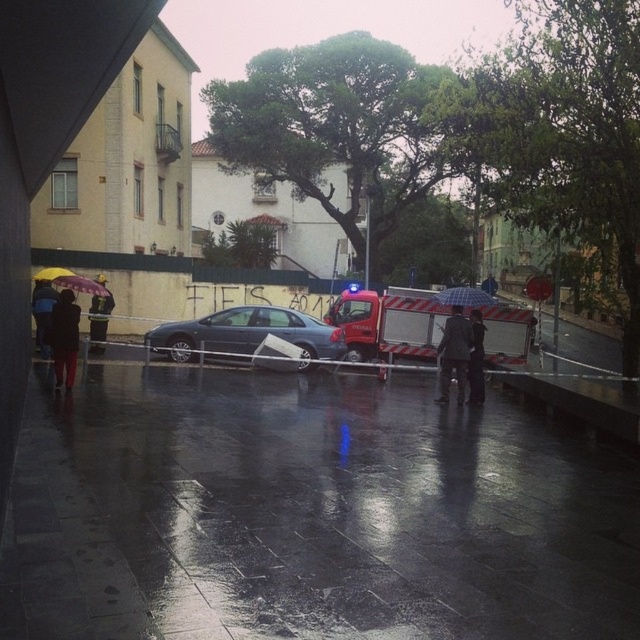
Looking at this image, does dark gray fabric jacket at center appear under plastic checkered umbrella at center?

Correct, dark gray fabric jacket at center is located below plastic checkered umbrella at center.

Does point (458, 316) come farther from viewer compared to point (464, 292)?

That is False.

The height and width of the screenshot is (640, 640). Find the location of `dark gray fabric jacket at center`. dark gray fabric jacket at center is located at coordinates (454, 353).

Is dark fabric umbrella at center bigger than dark gray fabric umbrella at left?

No, dark fabric umbrella at center is not bigger than dark gray fabric umbrella at left.

Who is lower down, dark fabric umbrella at center or dark gray fabric umbrella at left?

dark fabric umbrella at center is lower down.

The height and width of the screenshot is (640, 640). What do you see at coordinates (476, 358) in the screenshot?
I see `dark fabric umbrella at center` at bounding box center [476, 358].

Identify the location of dark fabric umbrella at center. The width and height of the screenshot is (640, 640). (476, 358).

Which is in front, point (488, 323) or point (42, 280)?

Positioned in front is point (42, 280).

The height and width of the screenshot is (640, 640). I want to click on metallic red fire truck at center, so click(388, 324).